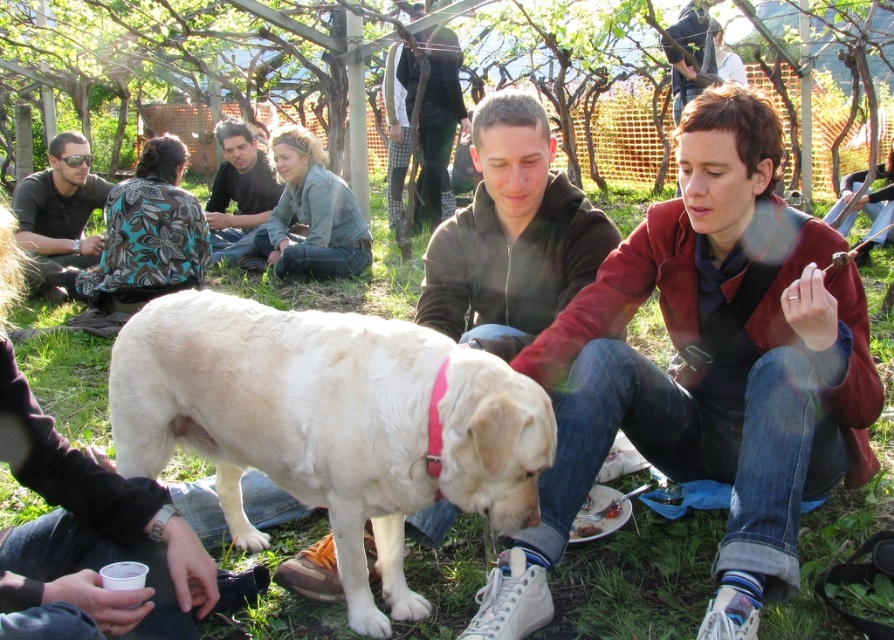
Question: Which object is farther from the camera taking this photo?

Choices:
 (A) light beige fur at center
 (B) green grass at center

Answer: (B)

Question: Is matte brown jacket at center thinner than light beige fur at center?

Choices:
 (A) no
 (B) yes

Answer: (A)

Question: Which of the following is the farthest from the observer?

Choices:
 (A) matte brown jacket at center
 (B) matte black jacket at upper left
 (C) light beige fur at center
 (D) dark brown leather jacket at center

Answer: (D)

Question: Can you confirm if matte brown jacket at center is smaller than matte black jacket at upper left?

Choices:
 (A) yes
 (B) no

Answer: (A)

Question: Can you confirm if green grass at center is bigger than matte black jacket at upper left?

Choices:
 (A) no
 (B) yes

Answer: (A)

Question: Which point is farther to the camera?

Choices:
 (A) (148, 305)
 (B) (201, 483)
 (C) (243, 177)

Answer: (C)